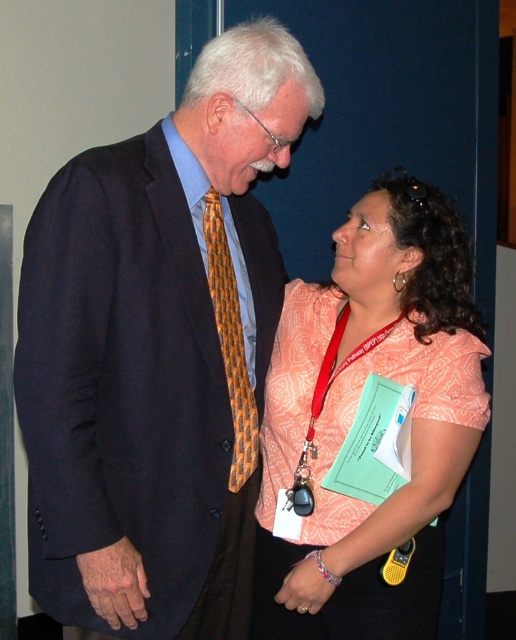
In the scene shown: Can you confirm if matte black suit at left is positioned to the right of patterned fabric blouse at center?

In fact, matte black suit at left is to the left of patterned fabric blouse at center.

Is point (258, 337) more distant than point (317, 561)?

Yes, it is.

Find the location of `matte black suit at left`. matte black suit at left is located at coordinates (157, 353).

Based on the photo, does matte black suit at left appear on the right side of orange woven tie at center?

Incorrect, matte black suit at left is not on the right side of orange woven tie at center.

Is matte black suit at left thinner than orange woven tie at center?

No, matte black suit at left is not thinner than orange woven tie at center.

You are a GUI agent. You are given a task and a screenshot of the screen. Output one action in this format:
    pyautogui.click(x=<x>, y=<y>)
    Task: Click on the matte black suit at left
    
    Given the screenshot: What is the action you would take?
    pyautogui.click(x=157, y=353)

Who is taller, patterned fabric blouse at center or orange woven tie at center?

patterned fabric blouse at center

Is point (413, 442) positioned before point (235, 451)?

No, it is not.

This screenshot has height=640, width=516. In order to click on patterned fabric blouse at center in this screenshot , I will do coord(354,412).